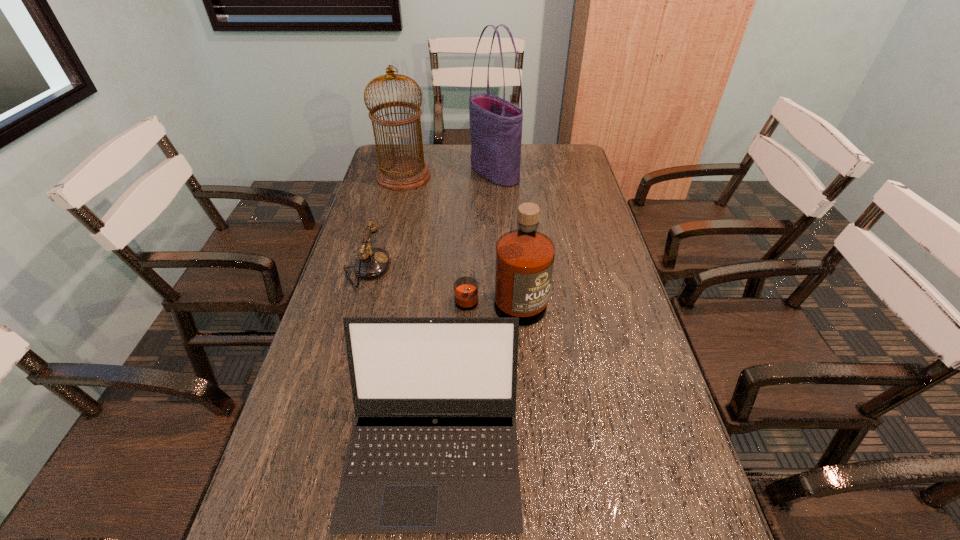
Where is `tote bag that is at the far edge`? This screenshot has width=960, height=540. tote bag that is at the far edge is located at coordinates (495, 124).

The width and height of the screenshot is (960, 540). Identify the location of birdcage located at the far edge. (401, 173).

In order to click on birdcage that is positioned at the left edge in this screenshot , I will do `click(401, 173)`.

Image resolution: width=960 pixels, height=540 pixels. I want to click on laptop situated at the left edge, so [433, 449].

The image size is (960, 540). I want to click on telephone present at the left edge, so click(371, 263).

The height and width of the screenshot is (540, 960). I want to click on object that is at the far left corner, so click(x=401, y=173).

The height and width of the screenshot is (540, 960). In order to click on vacant space at the far edge of the desktop in this screenshot , I will do `click(542, 167)`.

What are the coordinates of `vacant space at the left edge` in the screenshot? It's located at (375, 301).

Locate an element on the screen. vacant position at the right edge of the desktop is located at coordinates (618, 362).

Identify the location of vacant space at the far right corner of the desktop. The image size is (960, 540). (574, 146).